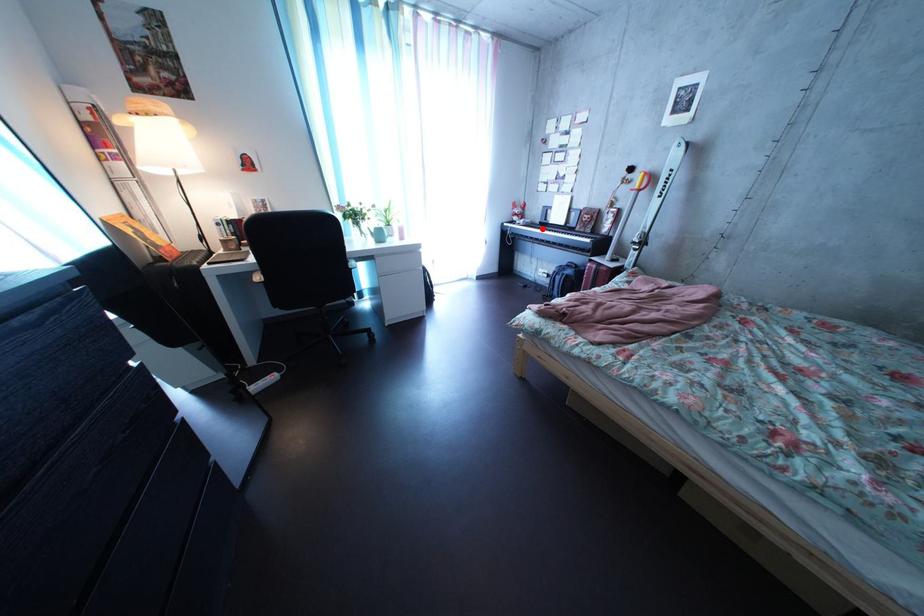
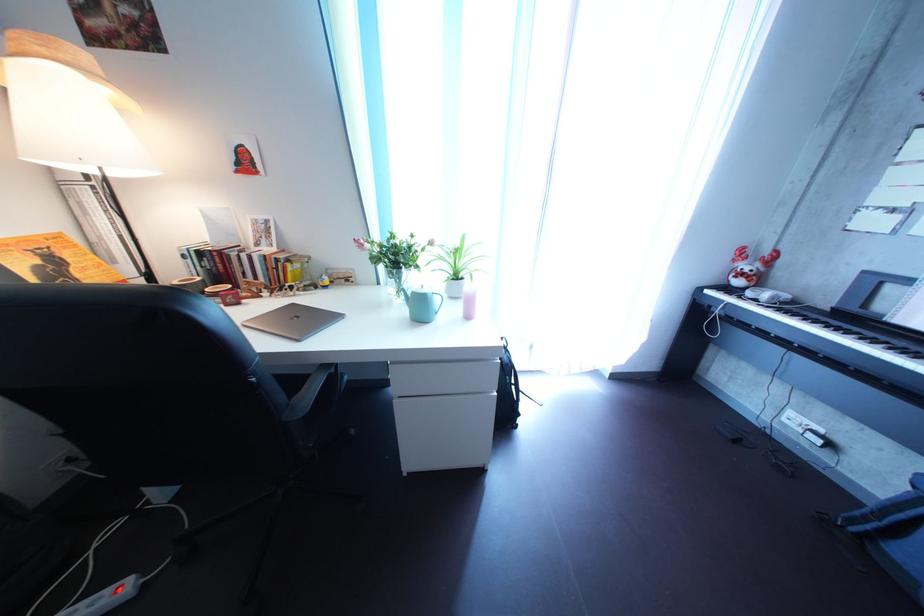
Question: I am providing you with two images of the same scene from different viewpoints. Given a red point in image1, look at the same physical point in image2. Is it:

Choices:
 (A) Closer to the viewpoint
 (B) Farther from the viewpoint

Answer: (B)